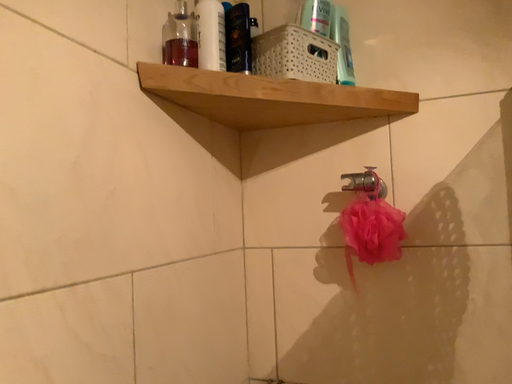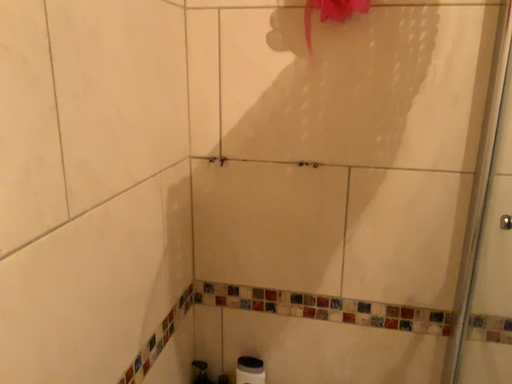
Question: Which way did the camera rotate in the video?

Choices:
 (A) rotated downward
 (B) rotated upward

Answer: (A)